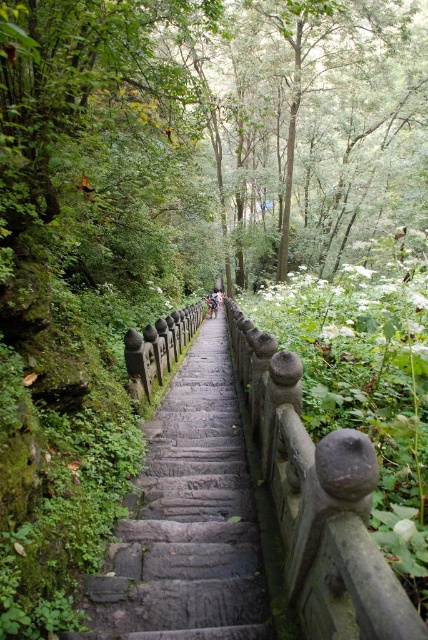
You are standing at the bottom of the gray stone stairs at center and want to reach the light brown wooden stick at center. Which direction should you move to get closer to the stick?

You should move forward up the gray stone stairs at center since the light brown wooden stick at center is further away from you than the stairs.